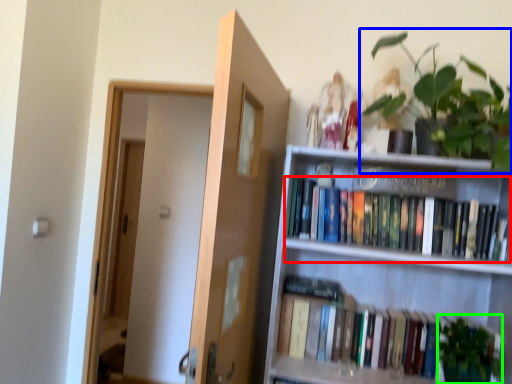
Question: Considering the real-world distances, which object is closest to book (highlighted by a red box)? houseplant (highlighted by a blue box) or plant (highlighted by a green box).

Choices:
 (A) houseplant
 (B) plant

Answer: (A)